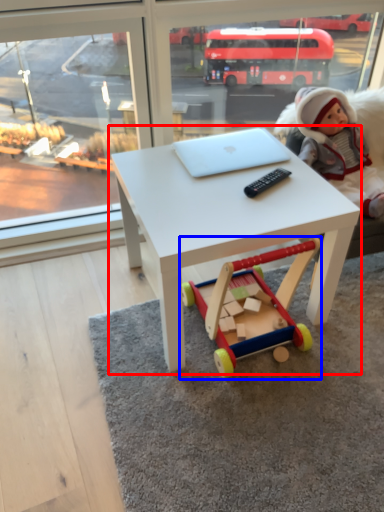
Question: Which object is further to the camera taking this photo, table (highlighted by a red box) or toy (highlighted by a blue box)?

Choices:
 (A) table
 (B) toy

Answer: (B)